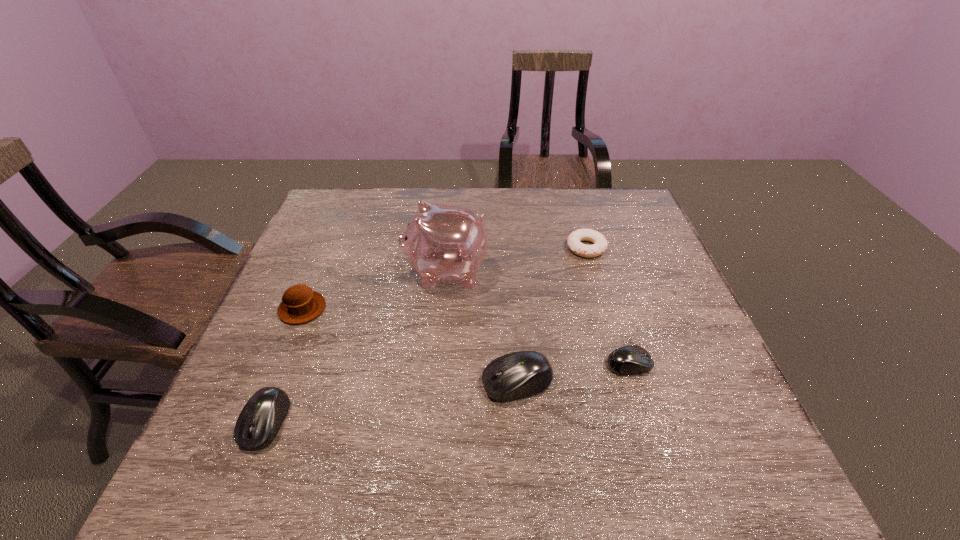
Where is `free space that satisfies the following two spatial constraints: 1. on the front side of the shortest mouse; 2. on the left side of the muffin`? free space that satisfies the following two spatial constraints: 1. on the front side of the shortest mouse; 2. on the left side of the muffin is located at coordinates (279, 364).

Locate an element on the screen. This screenshot has width=960, height=540. free location that satisfies the following two spatial constraints: 1. on the front facing side of the piggy bank; 2. on the back side of the second mouse from left to right is located at coordinates (436, 382).

The image size is (960, 540). What are the coordinates of `free spot that satisfies the following two spatial constraints: 1. on the back side of the tallest mouse; 2. on the front facing side of the tallest object` in the screenshot? It's located at (509, 272).

Image resolution: width=960 pixels, height=540 pixels. I want to click on vacant space that satisfies the following two spatial constraints: 1. on the front facing side of the piggy bank; 2. on the left side of the rightmost mouse, so click(438, 364).